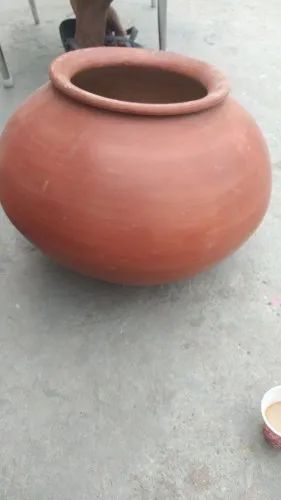
I want to click on dish, so click(x=275, y=442).